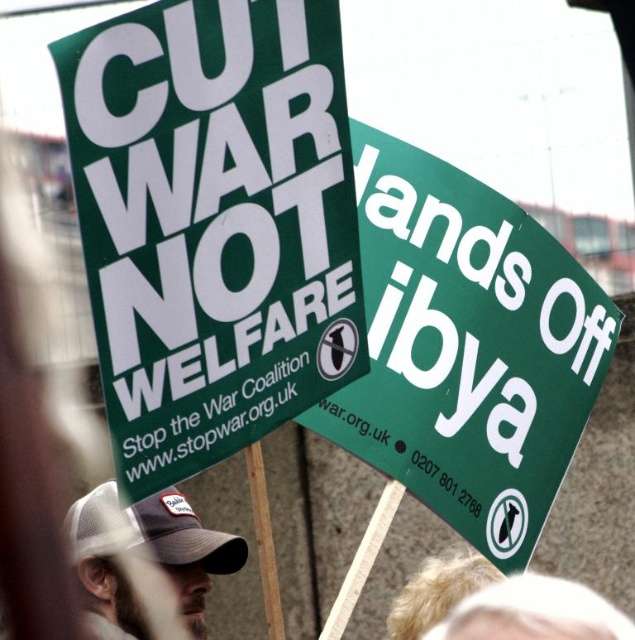
You are a photographer trying to capture the protest signs. You notice two points marked on your camera screen at coordinates point (246, 240) and point (145, 522). Which point do you need to focus on first if you want to ensure the closest sign is in sharp focus?

Point (246, 240) is closer to the viewer than point (145, 522), so you should focus on point (246, 240) first to ensure the closest sign is in sharp focus.